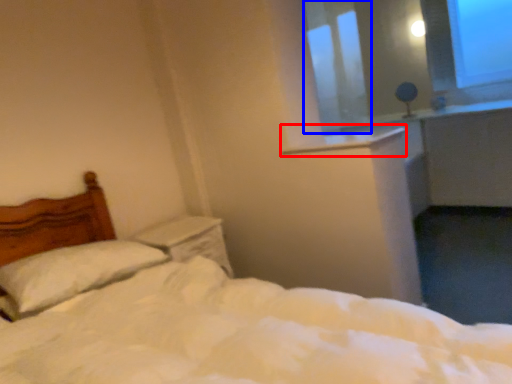
Question: Which object appears farthest to the camera in this image, window sill (highlighted by a red box) or window screen (highlighted by a blue box)?

Choices:
 (A) window sill
 (B) window screen

Answer: (B)